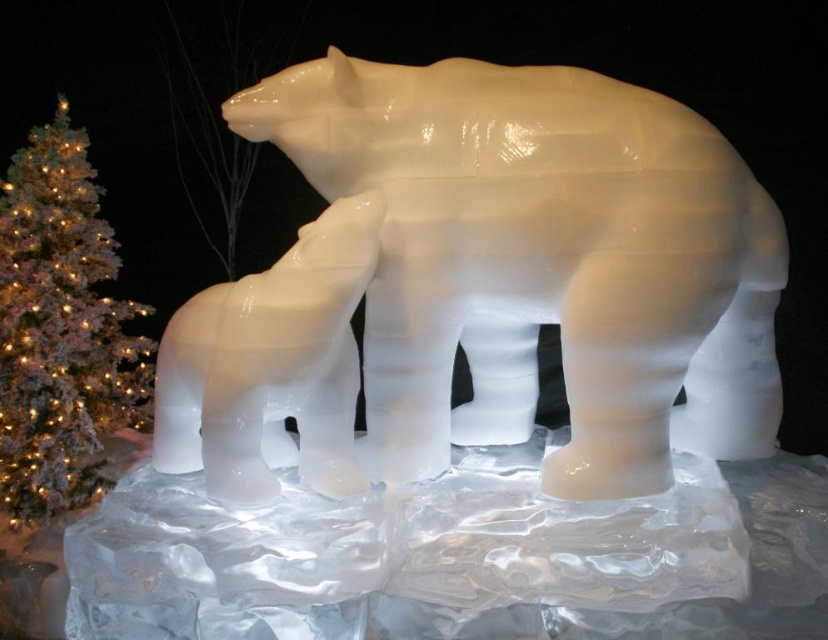
Question: Which object is the farthest from the white ice bear at center?

Choices:
 (A) white frosted christmas tree at left
 (B) white ice sculpture at center

Answer: (A)

Question: Can you confirm if white ice bear at center is positioned to the right of white frosted christmas tree at left?

Choices:
 (A) yes
 (B) no

Answer: (A)

Question: Can you confirm if white ice bear at center is positioned to the right of white frosted christmas tree at left?

Choices:
 (A) no
 (B) yes

Answer: (B)

Question: Among these objects, which one is nearest to the camera?

Choices:
 (A) white ice sculpture at center
 (B) white ice bear at center
 (C) white frosted christmas tree at left

Answer: (A)

Question: Among these points, which one is nearest to the camera?

Choices:
 (A) (571, 406)
 (B) (359, 237)
 (C) (55, 188)

Answer: (B)

Question: Can you confirm if white ice sculpture at center is positioned above white frosted christmas tree at left?

Choices:
 (A) no
 (B) yes

Answer: (B)